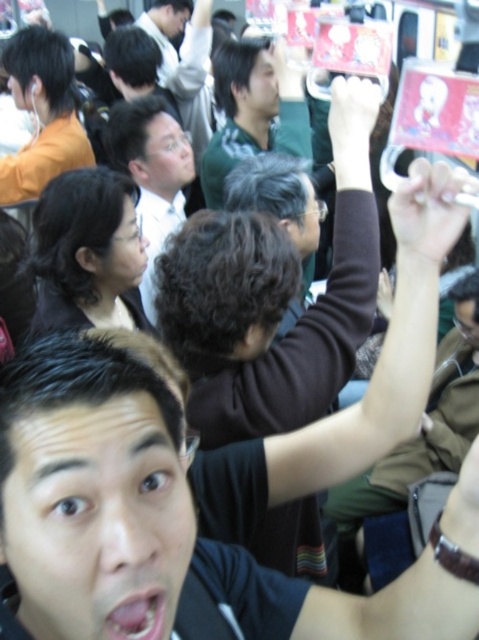
Question: Does brown fuzzy sweater at upper center appear over matte black shirt at center?

Choices:
 (A) yes
 (B) no

Answer: (B)

Question: Which object is farther from the camera taking this photo?

Choices:
 (A) brown fuzzy sweater at upper center
 (B) matte black shirt at center

Answer: (B)

Question: Observing the image, what is the correct spatial positioning of brown fuzzy sweater at upper center in reference to matte black shirt at center?

Choices:
 (A) left
 (B) right

Answer: (B)

Question: Does brown fuzzy sweater at upper center have a larger size compared to matte black shirt at center?

Choices:
 (A) no
 (B) yes

Answer: (B)

Question: Which of the following is the farthest from the observer?

Choices:
 (A) brown fuzzy sweater at upper center
 (B) matte black shirt at center

Answer: (B)

Question: Which object appears closest to the camera in this image?

Choices:
 (A) brown fuzzy sweater at upper center
 (B) matte black shirt at center

Answer: (A)